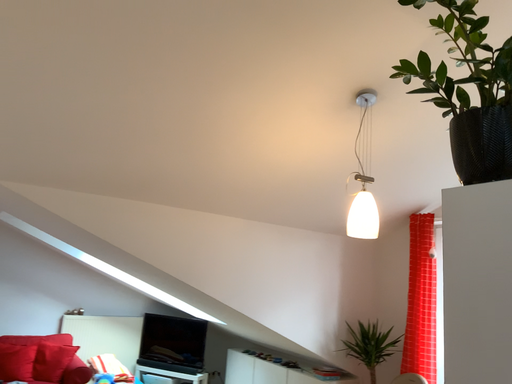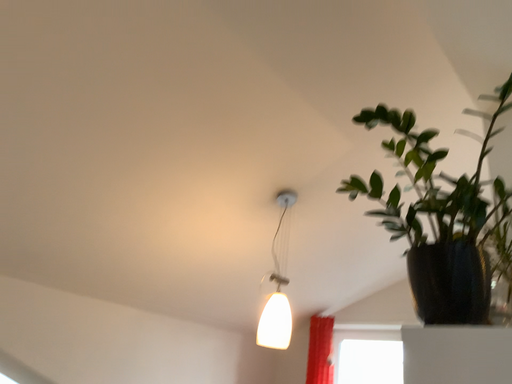
Question: Which way did the camera rotate in the video?

Choices:
 (A) rotated upward
 (B) rotated downward

Answer: (A)